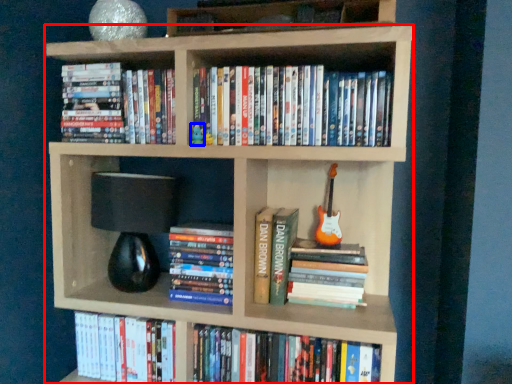
Question: Which of the following is the closest to the observer, bookcase (highlighted by a red box) or toy (highlighted by a blue box)?

Choices:
 (A) bookcase
 (B) toy

Answer: (A)